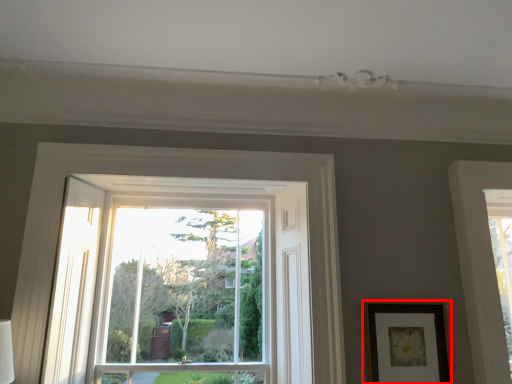
Question: From the image's perspective, where is picture frame (annotated by the red box) located relative to bay window?

Choices:
 (A) below
 (B) above

Answer: (A)